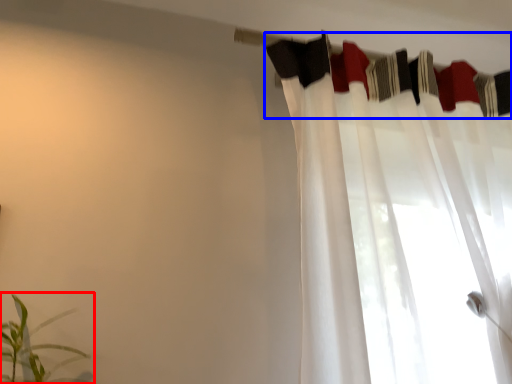
Question: Which point is closer to the camera, houseplant (highlighted by a red box) or clothesline (highlighted by a blue box)?

Choices:
 (A) houseplant
 (B) clothesline

Answer: (A)